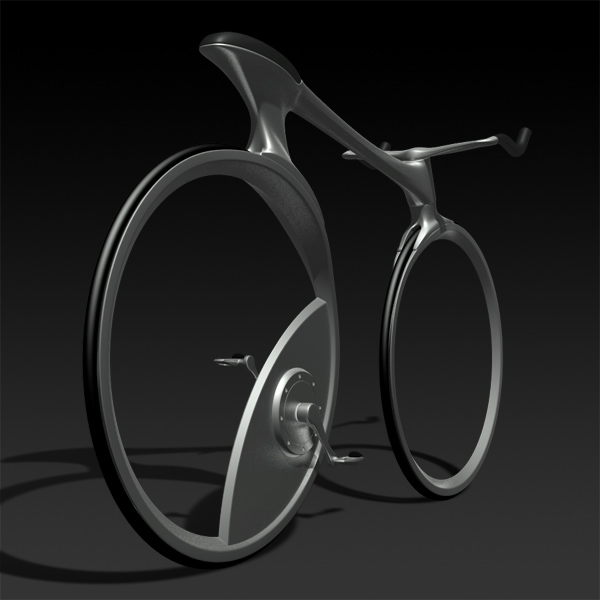
At what (x,y) coordinates should I click in order to perform the action: click on bar. Please return your answer as a coordinate pair (x, y). The height and width of the screenshot is (600, 600). Looking at the image, I should click on (417, 152).